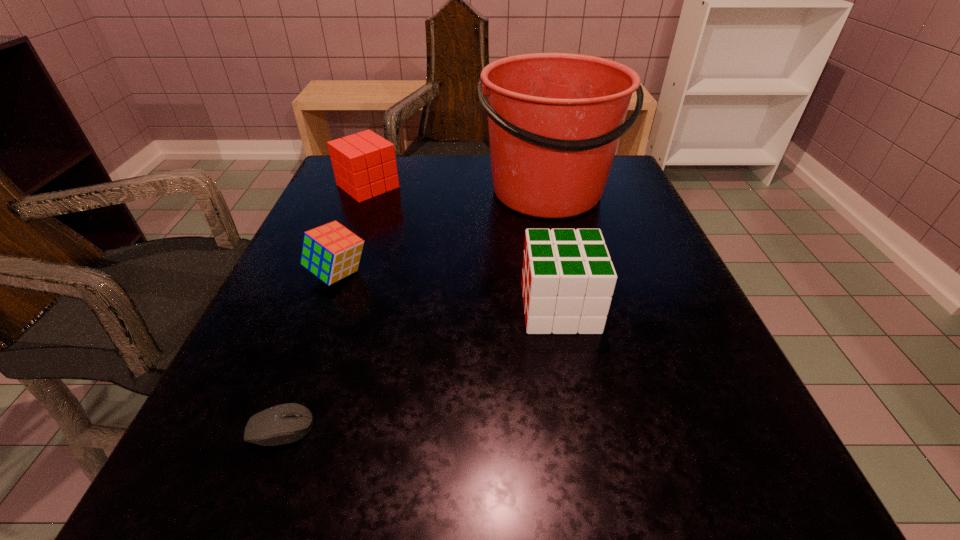
Locate an element on the screen. This screenshot has height=540, width=960. free point between the farthest cube and the tallest object is located at coordinates (458, 189).

Find the location of `object that is the second closest one to the shortest object`. object that is the second closest one to the shortest object is located at coordinates (568, 279).

What are the coordinates of `the second closest object relative to the bucket` in the screenshot? It's located at (364, 164).

Select which cube appears as the second closest to the farthest cube. Please provide its 2D coordinates. Your answer should be formatted as a tuple, i.e. [(x, y)], where the tuple contains the x and y coordinates of a point satisfying the conditions above.

[(568, 279)]

Identify which cube is the nearest to the nearest object. Please provide its 2D coordinates. Your answer should be formatted as a tuple, i.e. [(x, y)], where the tuple contains the x and y coordinates of a point satisfying the conditions above.

[(331, 252)]

Identify the location of free location that satisfies the following two spatial constraints: 1. on the front side of the tallest object; 2. on the red face of the rightmost cube. This screenshot has height=540, width=960. (575, 308).